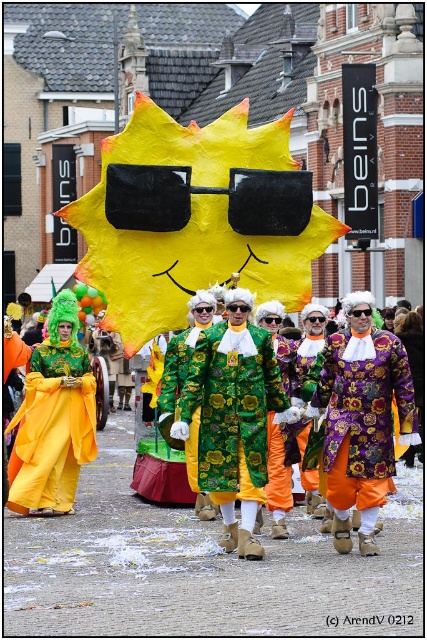
You are a photographer positioned at the front of the parade. You want to take a photo that includes both the green floral fabric coat at center and the purple velvet coat at center. Which coat should you move closer to ensure both are fully visible in the frame?

The purple velvet coat at center is behind the green floral fabric coat at center. To ensure both are fully visible, you should move closer to the green floral fabric coat at center so that the purple velvet coat at center doesn